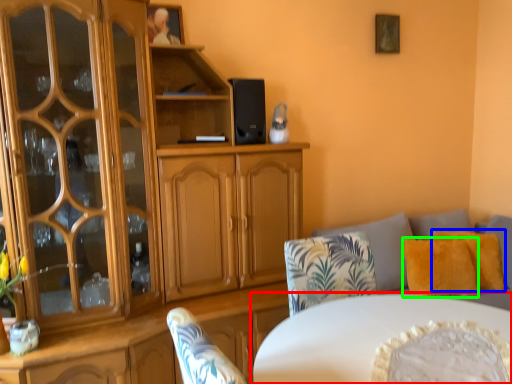
Question: Considering the real-world distances, which object is closest to table (highlighted by a red box)? pillow (highlighted by a blue box) or pillow (highlighted by a green box).

Choices:
 (A) pillow
 (B) pillow

Answer: (B)